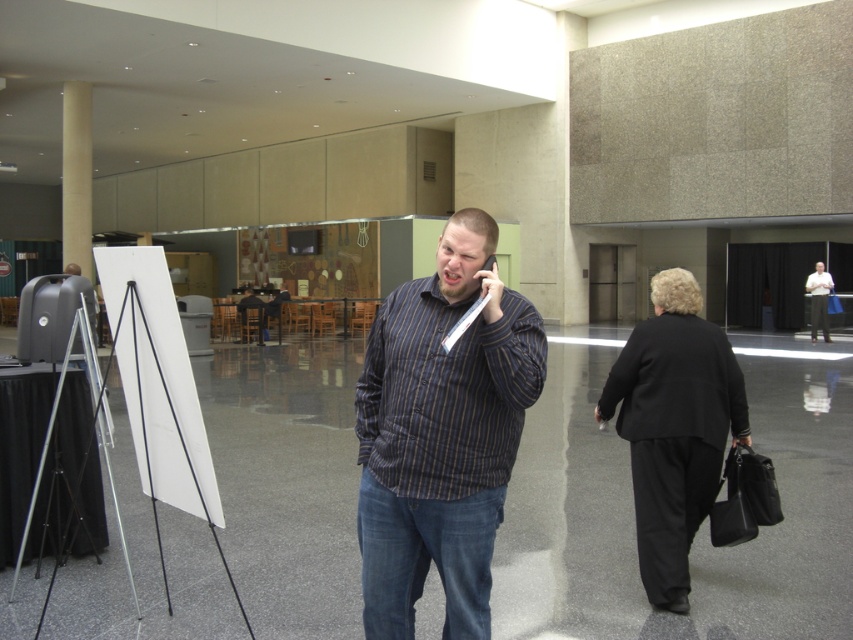
You are planning to hang a poster on the beige concrete pillar at left and the striped shirt at center. Which object has a larger width to accommodate a bigger poster?

The beige concrete pillar at left is wider than the striped shirt at center, so it can accommodate a bigger poster.

You are standing in the conference hall and need to locate the beige concrete pillar at left. According to the coordinates provided, where exactly is it positioned?

The beige concrete pillar at left is positioned at coordinates point (76, 176).